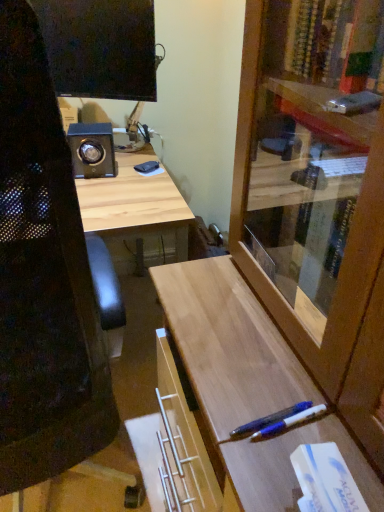
Question: Considering the relative sizes of translucent blue pen at lower right and wooden cabinet at center-right in the image provided, is translucent blue pen at lower right smaller than wooden cabinet at center-right?

Choices:
 (A) no
 (B) yes

Answer: (B)

Question: Can you confirm if translucent blue pen at lower right is shorter than wooden cabinet at center-right?

Choices:
 (A) yes
 (B) no

Answer: (A)

Question: Is wooden cabinet at center-right at the back of translucent blue pen at lower right?

Choices:
 (A) yes
 (B) no

Answer: (A)

Question: Can you confirm if translucent blue pen at lower right is taller than wooden cabinet at center-right?

Choices:
 (A) yes
 (B) no

Answer: (B)

Question: Is translucent blue pen at lower right thinner than wooden cabinet at center-right?

Choices:
 (A) no
 (B) yes

Answer: (B)

Question: Considering their positions, is translucent blue pen at lower right located in front of or behind white matte book at lower right?

Choices:
 (A) behind
 (B) front

Answer: (A)

Question: Is translucent blue pen at lower right to the left or to the right of white matte book at lower right in the image?

Choices:
 (A) left
 (B) right

Answer: (A)

Question: Looking at the image, does translucent blue pen at lower right seem bigger or smaller compared to white matte book at lower right?

Choices:
 (A) small
 (B) big

Answer: (A)

Question: Is point (261, 426) closer or farther from the camera than point (316, 505)?

Choices:
 (A) farther
 (B) closer

Answer: (A)

Question: Is black mesh computer chair at left inside or outside of wooden cabinet at center-right?

Choices:
 (A) inside
 (B) outside

Answer: (B)

Question: In terms of height, does black mesh computer chair at left look taller or shorter compared to wooden cabinet at center-right?

Choices:
 (A) short
 (B) tall

Answer: (B)

Question: Is black mesh computer chair at left wider or thinner than wooden cabinet at center-right?

Choices:
 (A) thin
 (B) wide

Answer: (B)

Question: Considering the positions of black mesh computer chair at left and wooden cabinet at center-right in the image, is black mesh computer chair at left bigger or smaller than wooden cabinet at center-right?

Choices:
 (A) big
 (B) small

Answer: (B)

Question: From the image's perspective, is black mesh computer chair at left above or below white matte book at lower right?

Choices:
 (A) below
 (B) above

Answer: (B)

Question: From their relative heights in the image, would you say black mesh computer chair at left is taller or shorter than white matte book at lower right?

Choices:
 (A) tall
 (B) short

Answer: (A)